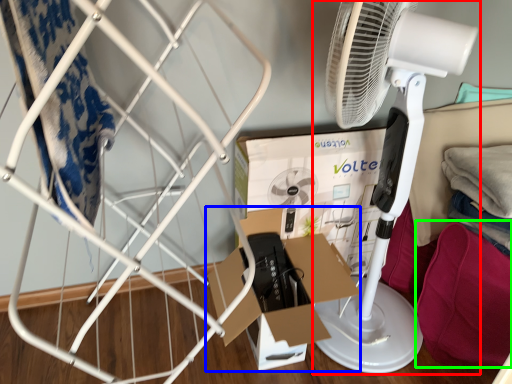
Question: Which is nearer to the mechanical fan (highlighted by a red box)? cardboard box (highlighted by a blue box) or clothing (highlighted by a green box).

Choices:
 (A) cardboard box
 (B) clothing

Answer: (B)